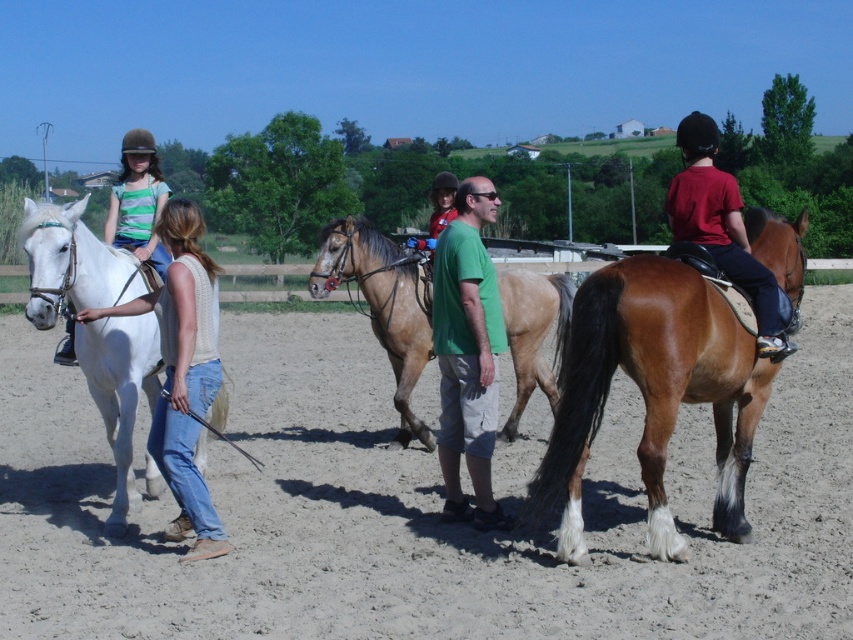
Question: Can you confirm if brown glossy horse at right is thinner than brown glossy horse at center?

Choices:
 (A) yes
 (B) no

Answer: (B)

Question: Which of the following is the farthest from the observer?

Choices:
 (A) matte red shirt at right
 (B) gray sand at center
 (C) white glossy horse at left

Answer: (A)

Question: Does brown glossy horse at right lie behind brown glossy horse at center?

Choices:
 (A) yes
 (B) no

Answer: (B)

Question: Which of the following is the closest to the observer?

Choices:
 (A) (128, 336)
 (B) (381, 326)

Answer: (A)

Question: Is gray sand at center below green cotton shirt at center?

Choices:
 (A) yes
 (B) no

Answer: (B)

Question: Which object is the closest to the green cotton shirt at center?

Choices:
 (A) gray sand at center
 (B) brown glossy horse at right
 (C) matte green shirt at center

Answer: (B)